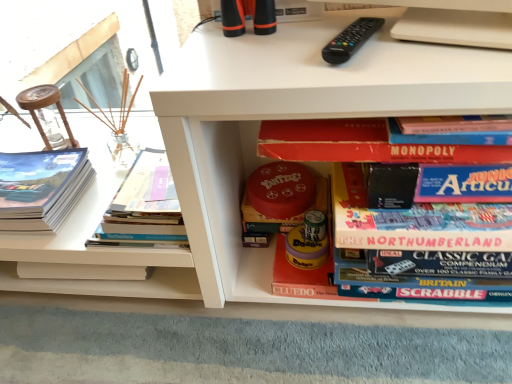
Question: Is black plastic remote at upper center positioned with its back to red matte board game at center, the 4th book viewed from the left?

Choices:
 (A) no
 (B) yes

Answer: (A)

Question: Does black plastic remote at upper center have a greater width compared to red matte board game at center, the 4th book viewed from the left?

Choices:
 (A) yes
 (B) no

Answer: (B)

Question: Is black plastic remote at upper center positioned beyond the bounds of red matte board game at center, which is counted as the first book, starting from the right?

Choices:
 (A) yes
 (B) no

Answer: (A)

Question: Considering the relative positions of black plastic remote at upper center and red matte board game at center, which is counted as the first book, starting from the right, in the image provided, is black plastic remote at upper center behind red matte board game at center, which is counted as the first book, starting from the right,?

Choices:
 (A) yes
 (B) no

Answer: (A)

Question: Considering the relative sizes of black plastic remote at upper center and red matte board game at center, the 4th book viewed from the left, in the image provided, is black plastic remote at upper center thinner than red matte board game at center, the 4th book viewed from the left,?

Choices:
 (A) yes
 (B) no

Answer: (A)

Question: From the image's perspective, is black plastic remote at upper center located above red matte board game at center, the 4th book viewed from the left?

Choices:
 (A) yes
 (B) no

Answer: (A)

Question: From a real-world perspective, is red matte yahtzee board game at center, acting as the 2th book starting from the right, beneath hardcover book at left, the 3th book in the right-to-left sequence?

Choices:
 (A) yes
 (B) no

Answer: (A)

Question: Would you say red matte yahtzee board game at center, the third book from the left, is outside hardcover book at left, which appears as the second book when viewed from the left?

Choices:
 (A) yes
 (B) no

Answer: (A)

Question: Is red matte yahtzee board game at center, the third book from the left, facing towards hardcover book at left, which appears as the second book when viewed from the left?

Choices:
 (A) yes
 (B) no

Answer: (B)

Question: Considering the relative sizes of red matte yahtzee board game at center, the third book from the left, and hardcover book at left, the 3th book in the right-to-left sequence, in the image provided, is red matte yahtzee board game at center, the third book from the left, smaller than hardcover book at left, the 3th book in the right-to-left sequence,?

Choices:
 (A) yes
 (B) no

Answer: (A)

Question: From the image's perspective, is red matte yahtzee board game at center, acting as the 2th book starting from the right, under hardcover book at left, which appears as the second book when viewed from the left?

Choices:
 (A) yes
 (B) no

Answer: (A)

Question: Is red matte yahtzee board game at center, the third book from the left, directly adjacent to hardcover book at left, which appears as the second book when viewed from the left?

Choices:
 (A) no
 (B) yes

Answer: (A)

Question: Is red matte board game at center, the 4th book viewed from the left, outside matte paper book at left, positioned as the 1th book in left-to-right order?

Choices:
 (A) no
 (B) yes

Answer: (B)